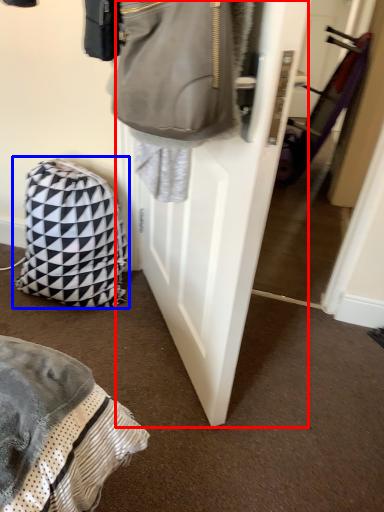
Question: Which object is closer to the camera taking this photo, door (highlighted by a red box) or backpack (highlighted by a blue box)?

Choices:
 (A) door
 (B) backpack

Answer: (A)